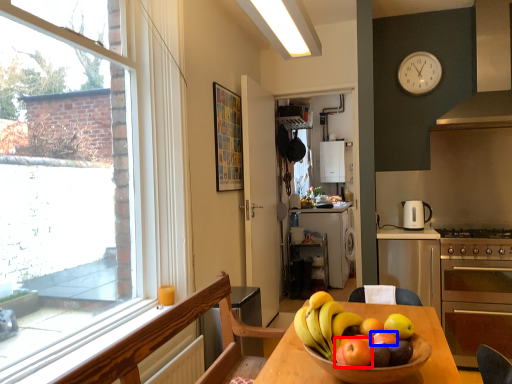
Question: Which object is closer to the camera taking this photo, apple (highlighted by a red box) or apple (highlighted by a blue box)?

Choices:
 (A) apple
 (B) apple

Answer: (A)